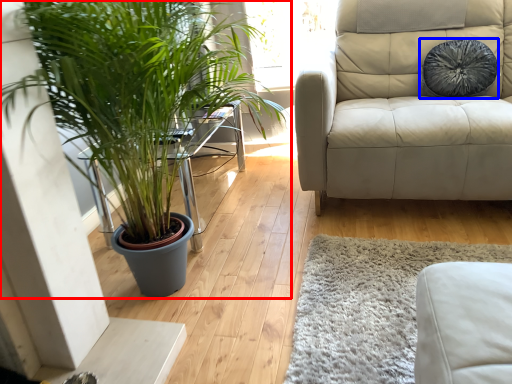
Question: Which object appears farthest to the camera in this image, houseplant (highlighted by a red box) or pillow (highlighted by a blue box)?

Choices:
 (A) houseplant
 (B) pillow

Answer: (B)